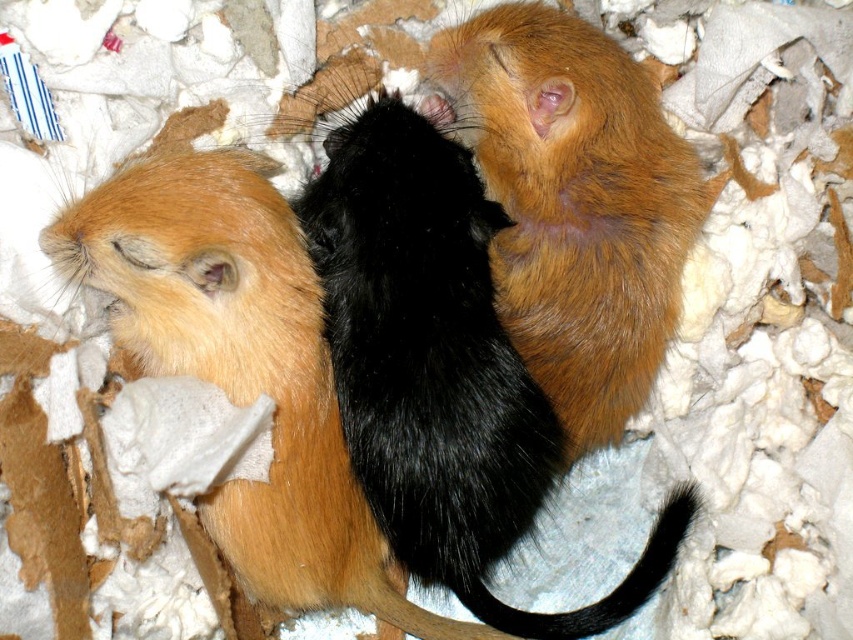
Who is more forward, (x=421, y=120) or (x=616, y=131)?

Point (x=616, y=131) is more forward.

Does black fur hamster at center have a larger size compared to golden fur hamster at center?

Yes.

The height and width of the screenshot is (640, 853). I want to click on black fur hamster at center, so click(440, 365).

The height and width of the screenshot is (640, 853). What are the coordinates of `black fur hamster at center` in the screenshot? It's located at (440, 365).

Does matte black hamster at center appear over black silky tail at center?

Yes.

Does matte black hamster at center lie behind black silky tail at center?

No, it is not.

I want to click on matte black hamster at center, so click(x=242, y=365).

Who is lower down, black fur hamster at center or black silky tail at center?

Positioned lower is black silky tail at center.

Between point (440, 179) and point (611, 595), which one is positioned in front?

Point (440, 179) is in front.

The image size is (853, 640). What do you see at coordinates (440, 365) in the screenshot?
I see `black fur hamster at center` at bounding box center [440, 365].

Where is `black fur hamster at center`? The width and height of the screenshot is (853, 640). black fur hamster at center is located at coordinates (440, 365).